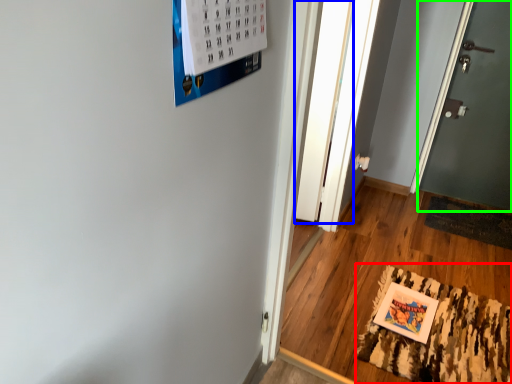
Question: Considering the real-world distances, which object is farthest from mat (highlighted by a red box)? glass door (highlighted by a blue box) or door (highlighted by a green box)?

Choices:
 (A) glass door
 (B) door

Answer: (B)